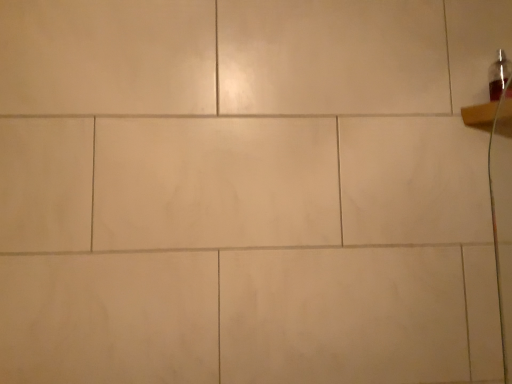
Where is `transparent glass bottle at upper right`? transparent glass bottle at upper right is located at coordinates (499, 75).

This screenshot has width=512, height=384. What do you see at coordinates (499, 75) in the screenshot?
I see `transparent glass bottle at upper right` at bounding box center [499, 75].

Locate an element on the screen. Image resolution: width=512 pixels, height=384 pixels. transparent glass bottle at upper right is located at coordinates (499, 75).